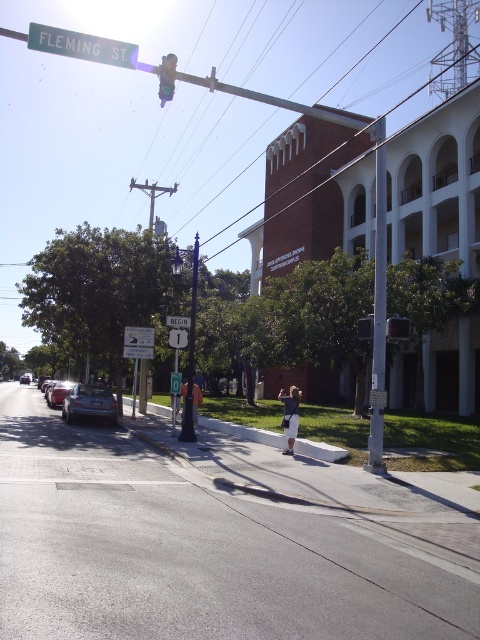
Question: Which of these objects is positioned farthest from the white plastic sign at upper center?

Choices:
 (A) green metallic street sign at upper center
 (B) metallic pole at center

Answer: (B)

Question: Which point is closer to the camera?

Choices:
 (A) (84, 408)
 (B) (451, 531)
 (C) (151, 339)
 (D) (362, 317)

Answer: (B)

Question: Can you confirm if metallic traffic light at center is positioned above shiny silver sedan at center?

Choices:
 (A) no
 (B) yes

Answer: (B)

Question: Which point appears farthest from the camera in this image?

Choices:
 (A) (26, 380)
 (B) (101, 416)
 (C) (388, 332)

Answer: (A)

Question: Can you confirm if green metallic street sign at upper center is bigger than denim jacket at lower center?

Choices:
 (A) yes
 (B) no

Answer: (A)

Question: Can you confirm if metallic silver car at lower left is positioned to the left of dark blue jeans at center?

Choices:
 (A) no
 (B) yes

Answer: (B)